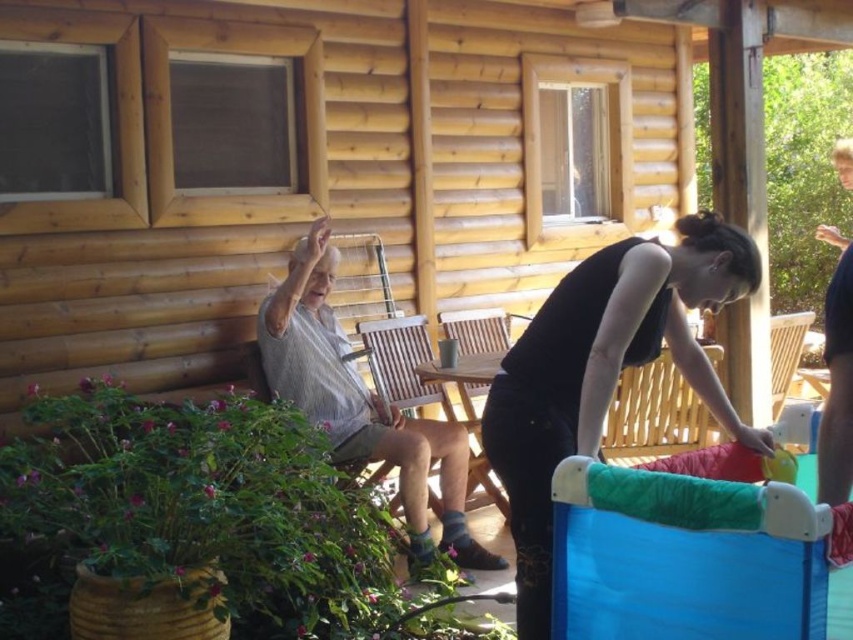
In the scene shown: You are standing in front of the cabin and want to take a photo of the black matte tank top at center. If your camera has a minimum focus distance of 2 meters, will you be able to take a clear photo without moving closer?

The black matte tank top at center is 2.15 meters away from the camera. Since the minimum focus distance is 2 meters, the camera can focus on the black matte tank top at center as it is within range.

You are a delivery person who needs to place a package between the black matte tank top at center and the light gray striped shirt at left. The package is 1.5 meters long. Will it fit between them?

The distance between the black matte tank top at center and the light gray striped shirt at left is 1.51 meters. Since the package is 1.5 meters long, it will fit with a small amount of space remaining.

You are organizing a clothing rack and see the black matte tank top at center and the light gray striped shirt at left. Which clothing item is covering the other?

The black matte tank top at center is positioned over the light gray striped shirt at left, so it is covering it.